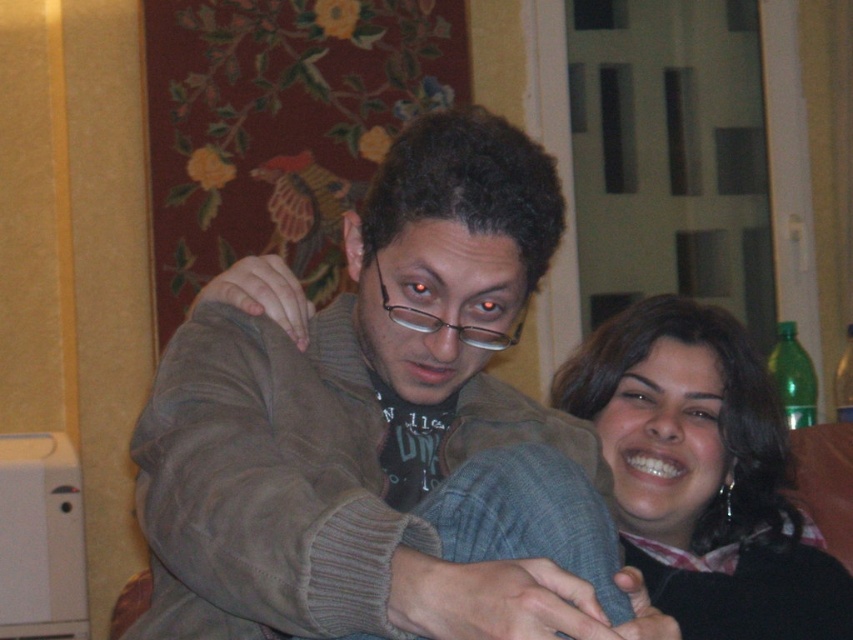
Question: Can you confirm if brown suede jacket at center is positioned above black matte hair at upper right?

Choices:
 (A) no
 (B) yes

Answer: (B)

Question: Which of the following is the farthest from the observer?

Choices:
 (A) (601, 337)
 (B) (544, 198)

Answer: (A)

Question: Does brown suede jacket at center have a smaller size compared to black matte hair at upper right?

Choices:
 (A) yes
 (B) no

Answer: (B)

Question: Can you confirm if brown suede jacket at center is positioned above black matte hair at upper right?

Choices:
 (A) yes
 (B) no

Answer: (A)